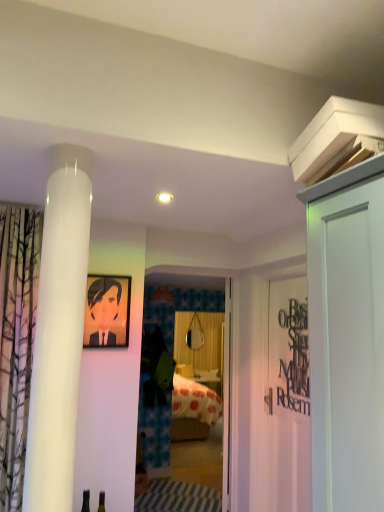
Measure the distance between matte black picture frame at upper left and camera.

matte black picture frame at upper left and camera are 2.56 meters apart.

What are the coordinates of `transparent glass door at center` in the screenshot? It's located at (188, 325).

This screenshot has width=384, height=512. I want to click on white glossy door at center, the first door viewed from the left, so click(227, 399).

From the image's perspective, between white glossy door at center, which appears as the 1th door when viewed from the back, and black matte sign at right, which one is located above?

black matte sign at right, from the image's perspective.

Is white glossy door at center, which appears as the 1th door when viewed from the back, turned away from black matte sign at right?

No, black matte sign at right is not at the back of white glossy door at center, which appears as the 1th door when viewed from the back.

Is white glossy door at center, which is the 2th door from front to back, smaller than black matte sign at right?

Incorrect, white glossy door at center, which is the 2th door from front to back, is not smaller in size than black matte sign at right.

From a real-world perspective, is white glossy door at center, which appears as the 1th door when viewed from the back, under white matte door at upper right, the first door when ordered from right to left?

Yes.

Are white glossy door at center, placed as the 2th door when sorted from right to left, and white matte door at upper right, acting as the second door starting from the left, beside each other?

No, white glossy door at center, placed as the 2th door when sorted from right to left, is not in contact with white matte door at upper right, acting as the second door starting from the left.

Is point (231, 296) positioned after point (341, 251)?

Yes, it is.

Is black matte sign at right behind white matte door at upper right, which is counted as the first door, starting from the front?

Yes.

Based on the photo, is black matte sign at right thinner than white matte door at upper right, which is counted as the first door, starting from the front?

Yes.

Between black matte sign at right and white matte door at upper right, which is counted as the first door, starting from the front, which one appears on the right side from the viewer's perspective?

From the viewer's perspective, white matte door at upper right, which is counted as the first door, starting from the front, appears more on the right side.

Is white matte door at upper right, the first door when ordered from right to left, a part of black matte sign at right?

No, white matte door at upper right, the first door when ordered from right to left, is located outside of black matte sign at right.

Which object is further away from the camera, white glossy door at center, the first door viewed from the left, or transparent glass door at center?

white glossy door at center, the first door viewed from the left, is more distant.

Would you consider white glossy door at center, placed as the 2th door when sorted from right to left, to be distant from transparent glass door at center?

Yes, white glossy door at center, placed as the 2th door when sorted from right to left, and transparent glass door at center are quite far apart.

Which of these two, white glossy door at center, the first door viewed from the left, or transparent glass door at center, is bigger?

white glossy door at center, the first door viewed from the left, is bigger.

From a real-world perspective, which object stands above the other?

transparent glass door at center is physically above.

From a real-world perspective, is white matte door at upper right, which is counted as the first door, starting from the front, on white glossy door at center, which is the 2th door from front to back?

Yes, from a real-world perspective, white matte door at upper right, which is counted as the first door, starting from the front, is over white glossy door at center, which is the 2th door from front to back

Based on the photo, from the image's perspective, which is above, white matte door at upper right, the first door when ordered from right to left, or white glossy door at center, the first door viewed from the left?

white matte door at upper right, the first door when ordered from right to left, appears higher in the image.

Considering the sizes of objects white matte door at upper right, placed as the 2th door when sorted from back to front, and white glossy door at center, which appears as the 1th door when viewed from the back, in the image provided, who is taller, white matte door at upper right, placed as the 2th door when sorted from back to front, or white glossy door at center, which appears as the 1th door when viewed from the back,?

Standing taller between the two is white glossy door at center, which appears as the 1th door when viewed from the back.

Is transparent glass door at center in front of black matte sign at right?

That is False.

You are a GUI agent. You are given a task and a screenshot of the screen. Output one action in this format:
    pyautogui.click(x=<x>, y=<y>)
    Task: Click on the glass door below the black matte sign at right (from a real-world perspective)
    Image resolution: width=384 pixels, height=512 pixels.
    Given the screenshot: What is the action you would take?
    pyautogui.click(x=188, y=325)

Is transparent glass door at center with black matte sign at right?

No, transparent glass door at center is not in contact with black matte sign at right.

Which of these two, transparent glass door at center or black matte sign at right, stands taller?

transparent glass door at center is taller.

Looking at this image, can you confirm if white matte door at upper right, which is counted as the first door, starting from the front, is taller than matte black picture frame at upper left?

Indeed, white matte door at upper right, which is counted as the first door, starting from the front, has a greater height compared to matte black picture frame at upper left.

At what (x,y) coordinates should I click in order to perform the action: click on door in front of the matte black picture frame at upper left. Please return your answer as a coordinate pair (x, y). This screenshot has height=512, width=384. Looking at the image, I should click on pyautogui.click(x=347, y=347).

Based on the photo, is white matte door at upper right, which is counted as the first door, starting from the front, positioned with its back to matte black picture frame at upper left?

That's not correct — white matte door at upper right, which is counted as the first door, starting from the front, is not looking away from matte black picture frame at upper left.

Image resolution: width=384 pixels, height=512 pixels. Find the location of `writing that appears above the white glossy door at center, which is the 2th door from front to back (from the image's perspective)`. writing that appears above the white glossy door at center, which is the 2th door from front to back (from the image's perspective) is located at coordinates (295, 358).

The image size is (384, 512). In order to click on door located on the left of white matte door at upper right, the first door when ordered from right to left in this screenshot , I will do `click(227, 399)`.

Based on their spatial positions, is matte black picture frame at upper left or transparent glass door at center closer to black matte sign at right?

matte black picture frame at upper left lies closer to black matte sign at right than the other object.

From the image, which object appears to be nearer to black matte sign at right, white glossy door at center, which is the 2th door from front to back, or white matte door at upper right, the first door when ordered from right to left?

white glossy door at center, which is the 2th door from front to back, is closer to black matte sign at right.

When comparing their distances from transparent glass door at center, does white glossy door at center, the first door viewed from the left, or black matte sign at right seem further?

The object further to transparent glass door at center is black matte sign at right.

Looking at the image, which one is located further to white glossy door at center, which appears as the 1th door when viewed from the back, matte black picture frame at upper left or transparent glass door at center?

The object further to white glossy door at center, which appears as the 1th door when viewed from the back, is transparent glass door at center.

Estimate the real-world distances between objects in this image. Which object is further from white matte door at upper right, placed as the 2th door when sorted from back to front, white glossy door at center, placed as the 2th door when sorted from right to left, or matte black picture frame at upper left?

Among the two, white glossy door at center, placed as the 2th door when sorted from right to left, is located further to white matte door at upper right, placed as the 2th door when sorted from back to front.

Looking at the image, which one is located closer to transparent glass door at center, white glossy door at center, which appears as the 1th door when viewed from the back, or matte black picture frame at upper left?

Among the two, white glossy door at center, which appears as the 1th door when viewed from the back, is located nearer to transparent glass door at center.

Estimate the real-world distances between objects in this image. Which object is further from black matte sign at right, transparent glass door at center or white matte door at upper right, the first door when ordered from right to left?

transparent glass door at center is further to black matte sign at right.

From the image, which object appears to be nearer to black matte sign at right, white matte door at upper right, the first door when ordered from right to left, or white glossy door at center, which is the 2th door from front to back?

Based on the image, white glossy door at center, which is the 2th door from front to back, appears to be nearer to black matte sign at right.

The height and width of the screenshot is (512, 384). I want to click on glass door between white matte door at upper right, which is counted as the first door, starting from the front, and white glossy door at center, placed as the 2th door when sorted from right to left, from front to back, so click(188, 325).

Image resolution: width=384 pixels, height=512 pixels. Find the location of `door situated between matte black picture frame at upper left and black matte sign at right from left to right`. door situated between matte black picture frame at upper left and black matte sign at right from left to right is located at coordinates (227, 399).

Image resolution: width=384 pixels, height=512 pixels. Find the location of `writing between white matte door at upper right, which is counted as the first door, starting from the front, and white glossy door at center, which is the 2th door from front to back, along the z-axis`. writing between white matte door at upper right, which is counted as the first door, starting from the front, and white glossy door at center, which is the 2th door from front to back, along the z-axis is located at coordinates (295, 358).

What are the coordinates of `glass door between matte black picture frame at upper left and black matte sign at right in the horizontal direction` in the screenshot? It's located at (188, 325).